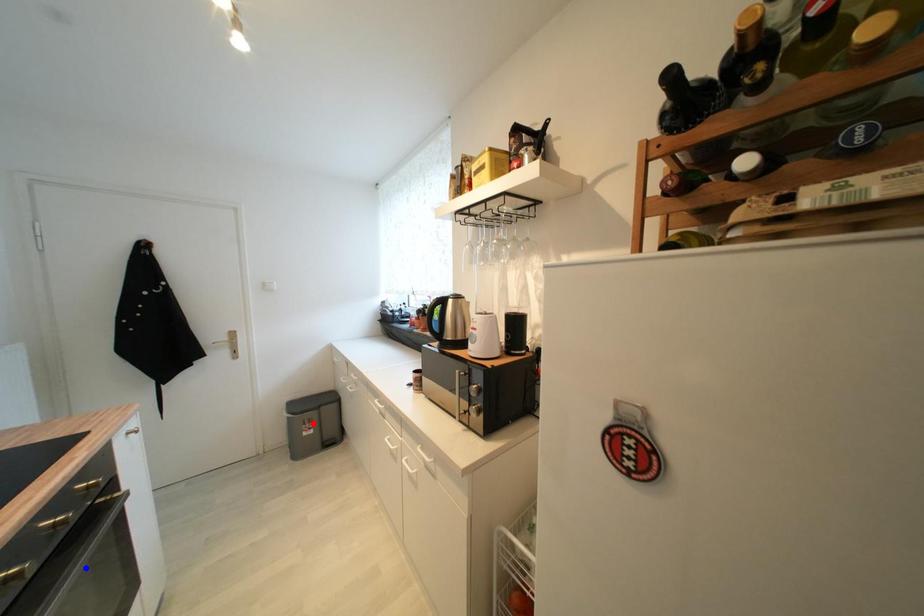
Question: Two points are marked on the image. Which point is closer to the camera?

Choices:
 (A) Blue point is closer.
 (B) Red point is closer.

Answer: (A)